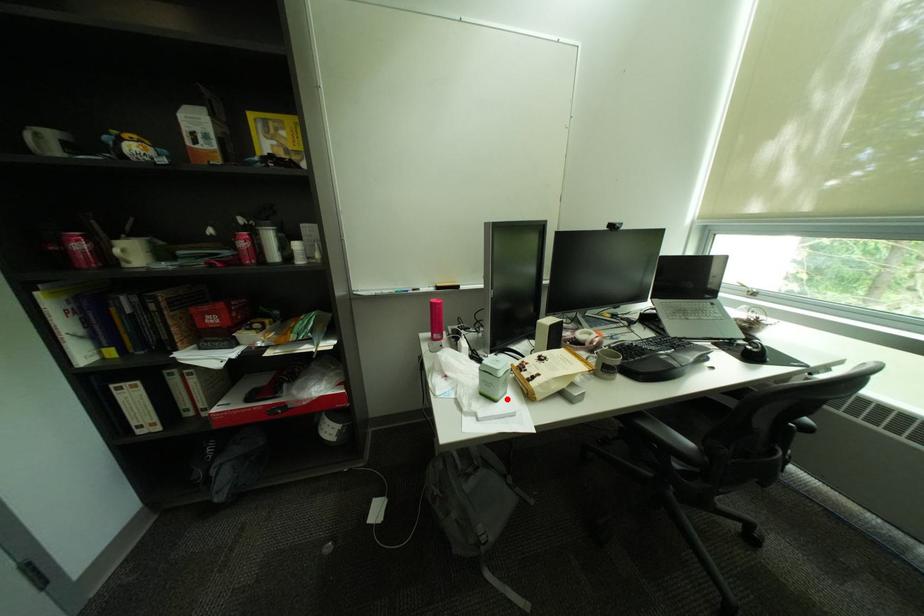
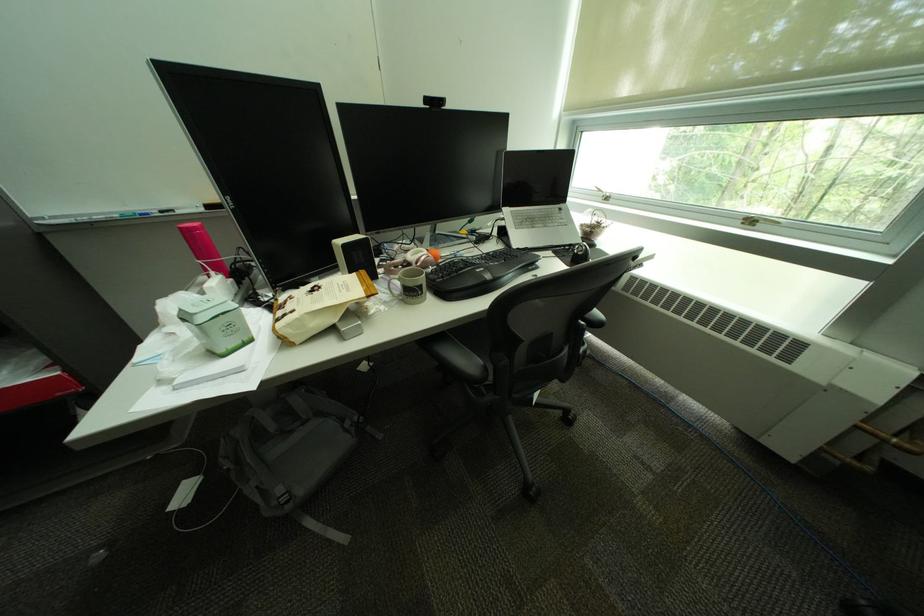
Question: I am providing you with two images of the same scene from different viewpoints. Image1 has a red point marked. In image2, the corresponding 3D location appears at what relative position? Reply with the corresponding letter.

Choices:
 (A) Closer
 (B) Farther

Answer: (A)